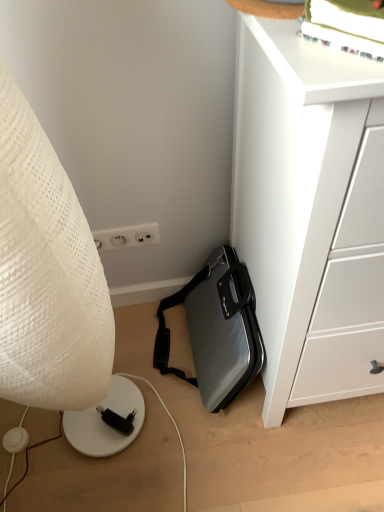
Question: Is there a large distance between white matte chest of drawers at lower right and silver textured briefcase at lower center?

Choices:
 (A) yes
 (B) no

Answer: (B)

Question: Is white matte chest of drawers at lower right thinner than silver textured briefcase at lower center?

Choices:
 (A) no
 (B) yes

Answer: (A)

Question: Is silver textured briefcase at lower center at the back of white matte chest of drawers at lower right?

Choices:
 (A) no
 (B) yes

Answer: (A)

Question: From the image's perspective, is white matte chest of drawers at lower right above silver textured briefcase at lower center?

Choices:
 (A) no
 (B) yes

Answer: (B)

Question: Is white matte chest of drawers at lower right touching silver textured briefcase at lower center?

Choices:
 (A) no
 (B) yes

Answer: (A)

Question: Is white matte chest of drawers at lower right smaller than silver textured briefcase at lower center?

Choices:
 (A) no
 (B) yes

Answer: (A)

Question: From the image's perspective, would you say silver textured briefcase at lower center is positioned over white textured lamp at left?

Choices:
 (A) yes
 (B) no

Answer: (B)

Question: Is silver textured briefcase at lower center placed right next to white textured lamp at left?

Choices:
 (A) yes
 (B) no

Answer: (B)

Question: Is silver textured briefcase at lower center positioned behind white textured lamp at left?

Choices:
 (A) yes
 (B) no

Answer: (A)

Question: Is white textured lamp at left inside silver textured briefcase at lower center?

Choices:
 (A) yes
 (B) no

Answer: (B)

Question: Considering the relative sizes of silver textured briefcase at lower center and white textured lamp at left in the image provided, is silver textured briefcase at lower center thinner than white textured lamp at left?

Choices:
 (A) yes
 (B) no

Answer: (A)

Question: Is silver textured briefcase at lower center taller than white textured lamp at left?

Choices:
 (A) yes
 (B) no

Answer: (B)

Question: Is white textured lamp at left located outside silver textured briefcase at lower center?

Choices:
 (A) no
 (B) yes

Answer: (B)